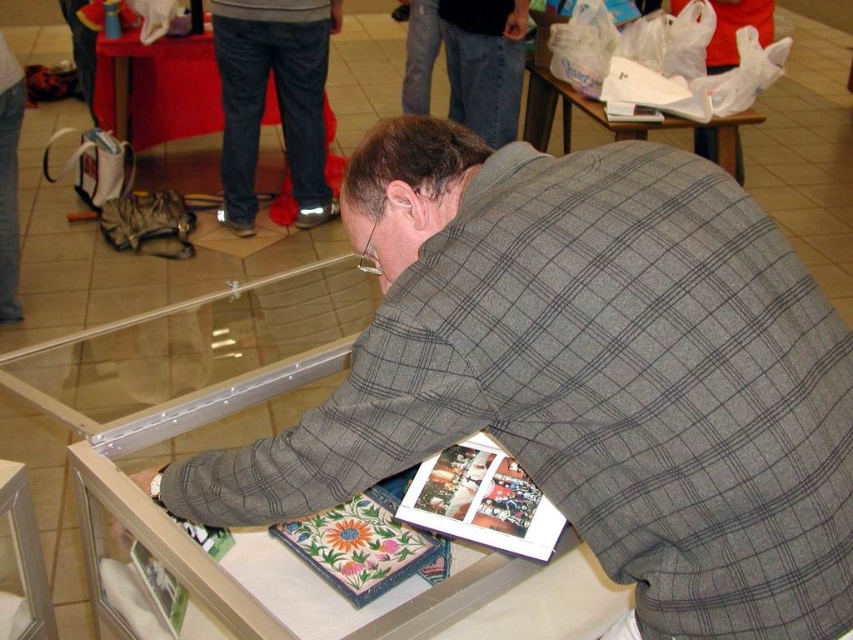
You are a photographer taking a picture of the scene. You want to ensure both the gray checkered shirt at center and the red fabric table at upper left are clearly visible in your photo. Which object should you focus on first to ensure proper exposure, considering their sizes?

The gray checkered shirt at center has a larger size compared to the red fabric table at upper left, so you should focus on the gray checkered shirt at center first to ensure proper exposure.

You are a photographer taking a picture of the scene. You want to ensure both the gray checkered shirt at center and the red fabric table at upper left are clearly visible. Based on their positions, which object is closer to the right edge of the frame?

The gray checkered shirt at center is positioned on the right side of the red fabric table at upper left, so it is closer to the right edge of the frame.

You are a customer in a store and see the display case with the matte paper magazine at center and the floral fabric magazine at lower center. Which magazine is taller?

The floral fabric magazine at lower center is taller than the matte paper magazine at center.